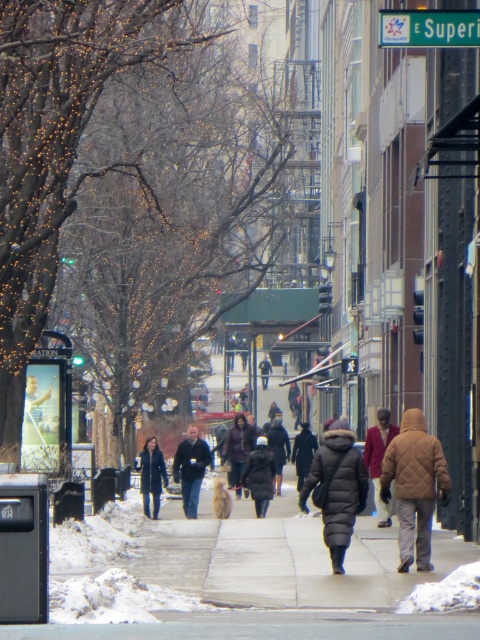
In the scene shown: You are standing at the point marked by the coordinates (415, 486) in the image. Looking around, you see a brown quilted jacket at center right. Which direction should you walk to reach the brown quilted jacket at center right?

Since you are already at the point where the brown quilted jacket at center right is located, you don not need to move further in any direction. You are already at the location of the brown quilted jacket at center right.

You are standing at the point marked by the coordinates point [379,460] in the image. What is the color of the fabric coat located at that position?

The point [379,460] marks the maroon fabric coat at center, so the color is maroon.